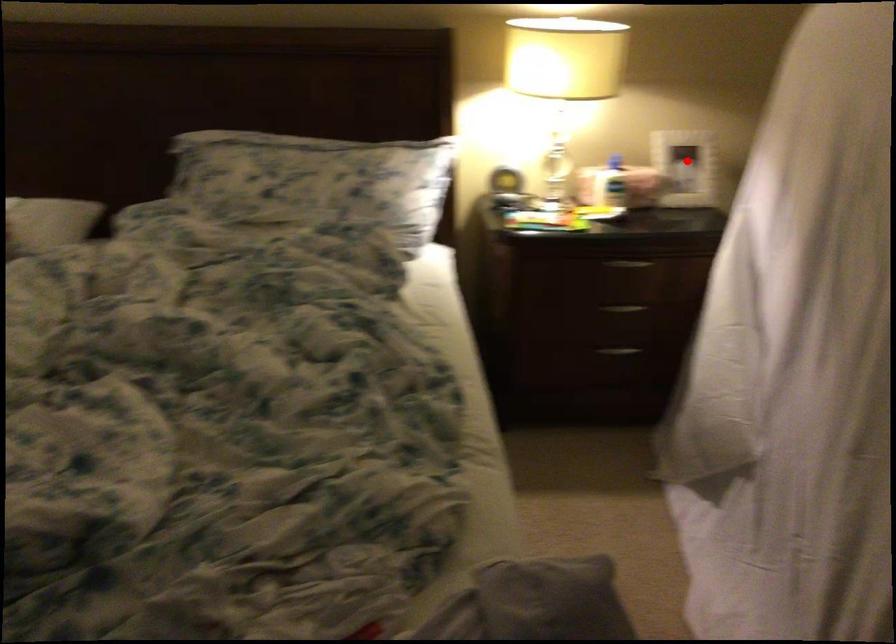
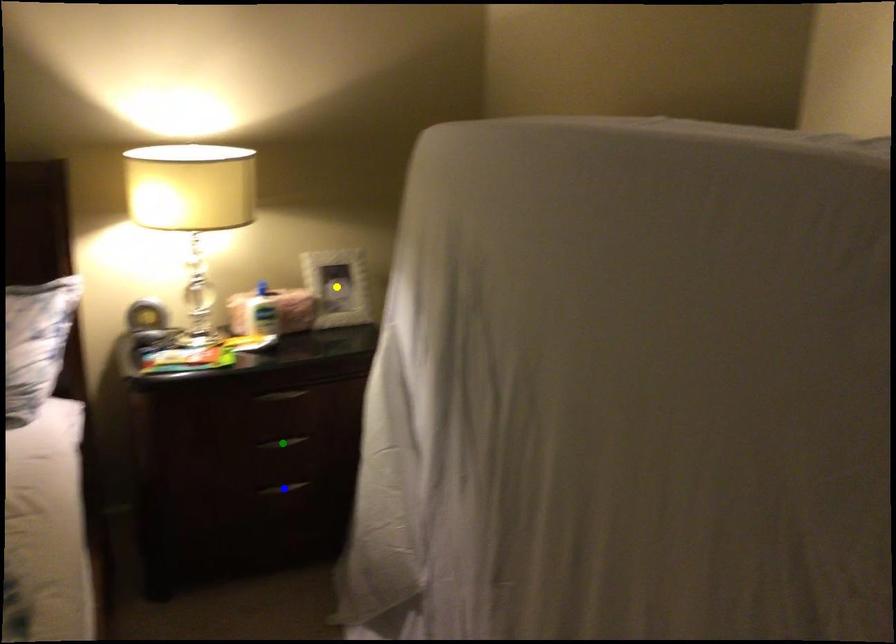
Question: I am providing you with two images of the same scene from different viewpoints. A red point is marked on the first image. You are given multiple points on the second image. Can you choose the point in image 2 that corresponds to the point in image 1?

Choices:
 (A) green point
 (B) blue point
 (C) yellow point

Answer: (C)